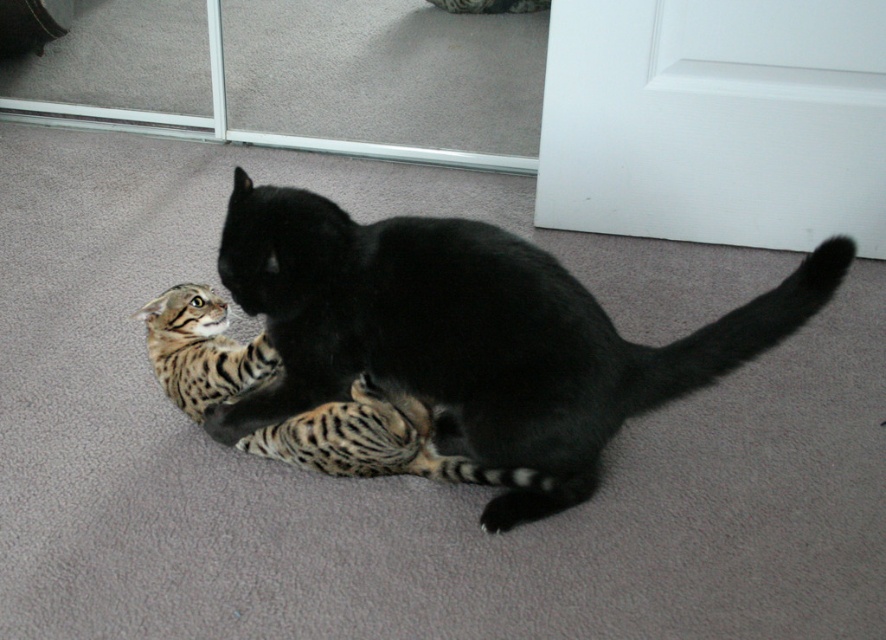
Question: Which point is farther to the camera?

Choices:
 (A) tabby fur kitten at lower left
 (B) black glossy cat at center

Answer: (A)

Question: Which object is the closest to the black glossy cat at center?

Choices:
 (A) striped fur paw at lower center
 (B) tabby fur kitten at lower left

Answer: (B)

Question: Is tabby fur kitten at lower left smaller than striped fur paw at lower center?

Choices:
 (A) no
 (B) yes

Answer: (A)

Question: Which of the following is the closest to the observer?

Choices:
 (A) (468, 269)
 (B) (166, 333)
 (C) (222, 428)

Answer: (A)

Question: Is tabby fur kitten at lower left closer to the viewer compared to striped fur paw at lower center?

Choices:
 (A) yes
 (B) no

Answer: (A)

Question: Is tabby fur kitten at lower left thinner than striped fur paw at lower center?

Choices:
 (A) yes
 (B) no

Answer: (B)